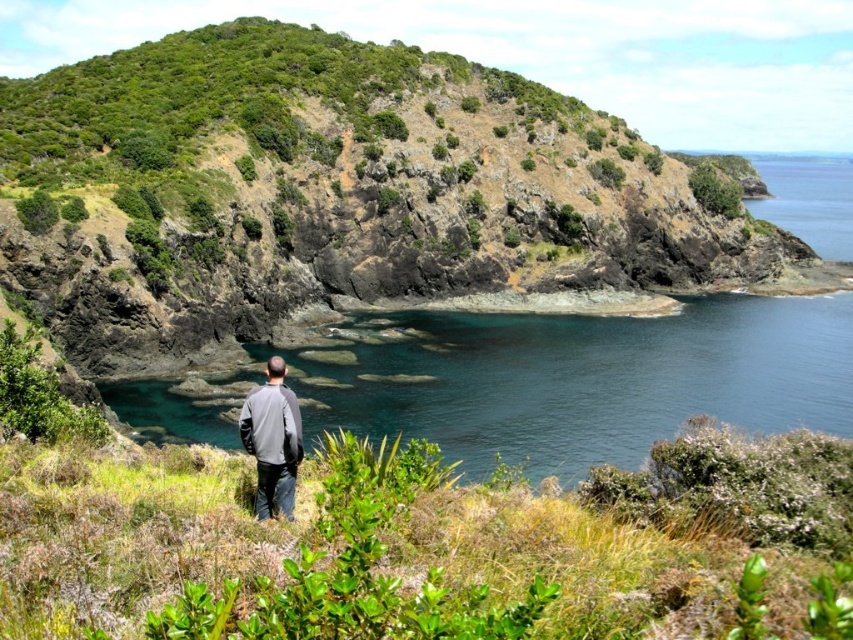
Question: Among these points, which one is farthest from the camera?

Choices:
 (A) (309, 435)
 (B) (287, 456)

Answer: (A)

Question: Does clear blue water at center appear under gray fleece jacket at center?

Choices:
 (A) yes
 (B) no

Answer: (B)

Question: Is clear blue water at center closer to the viewer compared to green leafy shrub at upper center?

Choices:
 (A) no
 (B) yes

Answer: (B)

Question: Among these objects, which one is nearest to the camera?

Choices:
 (A) gray fleece jacket at center
 (B) clear blue water at center
 (C) green leafy shrub at upper center

Answer: (A)

Question: Which point is farther from the camera taking this photo?

Choices:
 (A) (271, 496)
 (B) (741, 376)

Answer: (B)

Question: Is clear blue water at center below gray fleece jacket at center?

Choices:
 (A) yes
 (B) no

Answer: (B)